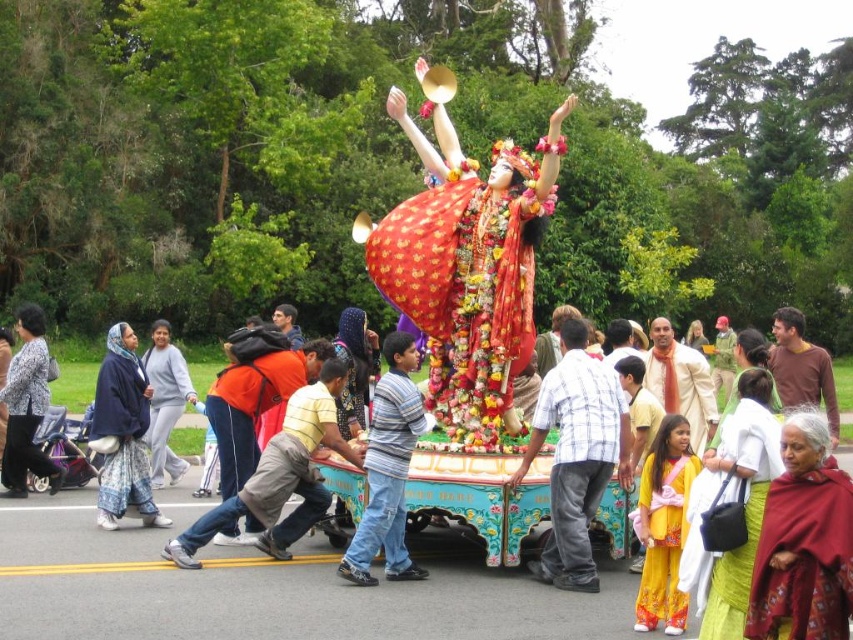
You are part of the crowd watching the procession and want to take a photo of the striped cotton shirt at center without the shiny red fabric at center blocking it. How should you adjust your position?

Move to a position where the striped cotton shirt at center is no longer behind the shiny red fabric at center. Since the striped cotton shirt at center is behind shiny red fabric at center, moving sideways or changing your angle could allow you to see the shirt without obstruction.